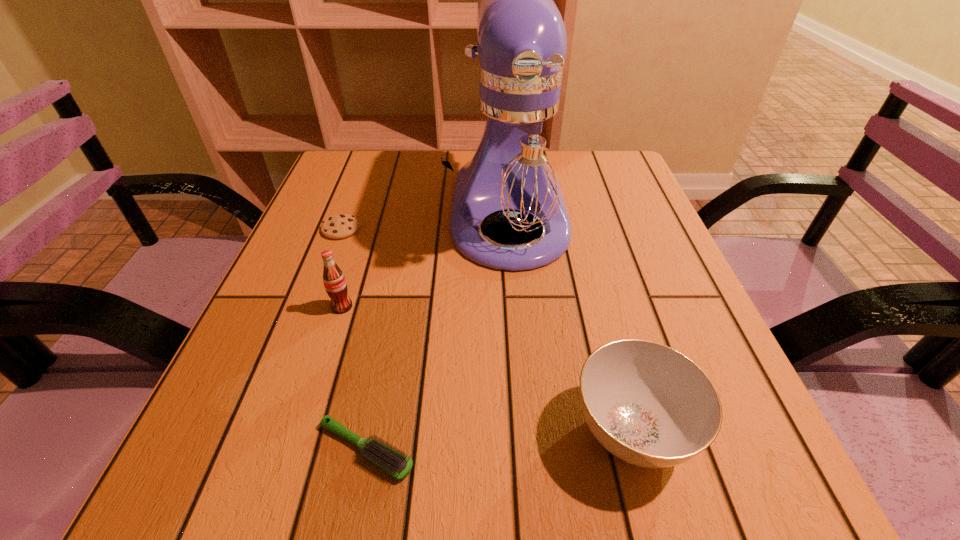
This screenshot has width=960, height=540. What are the coordinates of `free space that is in between the cookie and the third object from left to right` in the screenshot? It's located at (353, 339).

Identify the location of free space between the third object from left to right and the cookie. (353, 339).

Locate an element on the screen. The image size is (960, 540). empty space that is in between the cookie and the third object from right to left is located at coordinates (353, 339).

The height and width of the screenshot is (540, 960). In order to click on object that ranks as the fourth closest to the hairbrush in this screenshot , I will do 339,226.

Locate which object ranks third in proximity to the chinaware. Please provide its 2D coordinates. Your answer should be formatted as a tuple, i.e. [(x, y)], where the tuple contains the x and y coordinates of a point satisfying the conditions above.

[(335, 284)]

You are a GUI agent. You are given a task and a screenshot of the screen. Output one action in this format:
    pyautogui.click(x=<x>, y=<y>)
    Task: Click on the free space that satisfies the following two spatial constraints: 1. at the mixing area of the mixer; 2. on the right side of the chinaware
    
    Given the screenshot: What is the action you would take?
    pyautogui.click(x=527, y=430)

Image resolution: width=960 pixels, height=540 pixels. In order to click on free point that satisfies the following two spatial constraints: 1. at the mixing area of the tallest object; 2. on the left side of the third shortest object in this screenshot , I will do click(527, 430).

Image resolution: width=960 pixels, height=540 pixels. In order to click on vacant area that satisfies the following two spatial constraints: 1. at the mixing area of the tallest object; 2. on the left side of the third tallest object in this screenshot , I will do `click(527, 430)`.